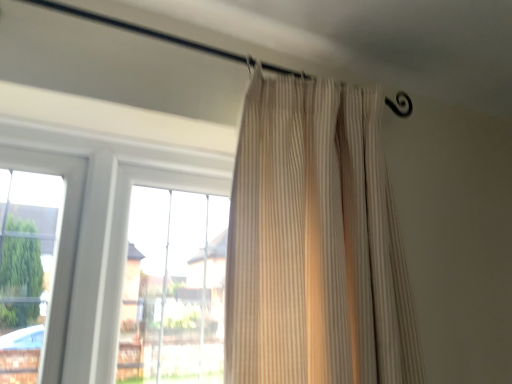
The image size is (512, 384). Describe the element at coordinates (315, 243) in the screenshot. I see `beige striped curtain at upper center` at that location.

In order to face beige striped curtain at upper center, should I rotate leftwards or rightwards?

Rotate right and turn 12.105 degrees.

Image resolution: width=512 pixels, height=384 pixels. Find the location of `beige striped curtain at upper center`. beige striped curtain at upper center is located at coordinates click(315, 243).

Where is `beige striped curtain at upper center`? beige striped curtain at upper center is located at coordinates (315, 243).